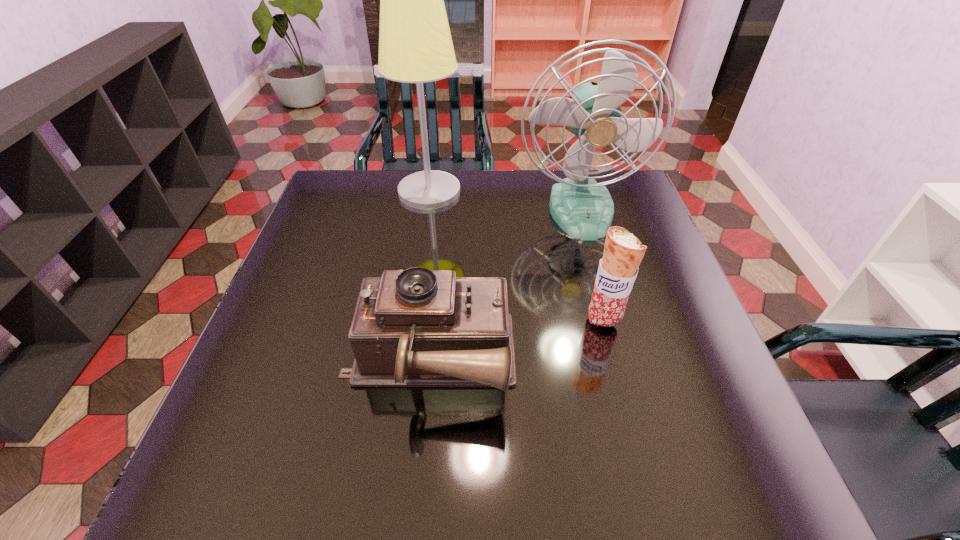
Where is `table lamp`? The width and height of the screenshot is (960, 540). table lamp is located at coordinates (415, 46).

This screenshot has height=540, width=960. I want to click on the second tallest object, so click(584, 209).

Where is `burrito`? burrito is located at coordinates (623, 252).

This screenshot has height=540, width=960. What are the coordinates of `the shortest object` in the screenshot? It's located at (417, 327).

Identify the location of free space located 0.190m on the front of the table lamp. (420, 252).

Identify the location of vacant space located 0.080m in front of the third shortest object, directing airflow. point(594,260).

Locate an element on the screen. The width and height of the screenshot is (960, 540). free space located 0.300m on the left of the burrito is located at coordinates (454, 320).

Locate an element on the screen. Image resolution: width=960 pixels, height=540 pixels. vacant space located on the horn of the shortest object is located at coordinates (572, 362).

Identify the location of table lamp present at the far edge. (415, 46).

Locate an element on the screen. This screenshot has width=960, height=540. fan present at the far edge is located at coordinates (584, 209).